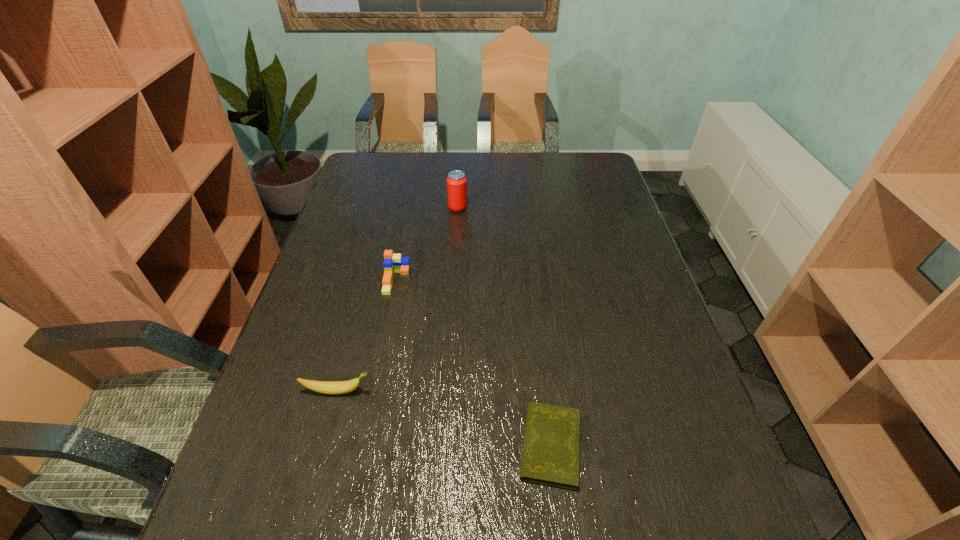
Where is `object present at the left edge`? This screenshot has width=960, height=540. object present at the left edge is located at coordinates (327, 387).

Find the location of a particular element. The width and height of the screenshot is (960, 540). vacant region at the far edge of the desktop is located at coordinates (468, 176).

You are a GUI agent. You are given a task and a screenshot of the screen. Output one action in this format:
    pyautogui.click(x=<x>, y=<y>)
    Task: Click on the vacant area at the left edge
    The height and width of the screenshot is (540, 960).
    Given the screenshot: What is the action you would take?
    374,207

In the image, there is a desktop. What are the coordinates of `vacant space at the right edge` in the screenshot? It's located at (625, 315).

Find the location of a particular element. free spot at the far right corner of the desktop is located at coordinates (568, 166).

Find the location of `vacant area that lies between the second nearest object and the second farthest object`. vacant area that lies between the second nearest object and the second farthest object is located at coordinates (368, 336).

You are a GUI agent. You are given a task and a screenshot of the screen. Output one action in this format:
    pyautogui.click(x=<x>, y=<y>)
    Task: Click on the free space between the second object from right to left and the rightmost object
    The height and width of the screenshot is (540, 960).
    Given the screenshot: What is the action you would take?
    pyautogui.click(x=504, y=327)

Image resolution: width=960 pixels, height=540 pixels. I want to click on empty space that is in between the farthest object and the second farthest object, so click(427, 245).

Identify the location of vacant space in between the shortest object and the banana. The height and width of the screenshot is (540, 960). (444, 418).

The height and width of the screenshot is (540, 960). What are the coordinates of `vacant space that is in between the Lego and the second object from right to left` in the screenshot? It's located at (x=427, y=245).